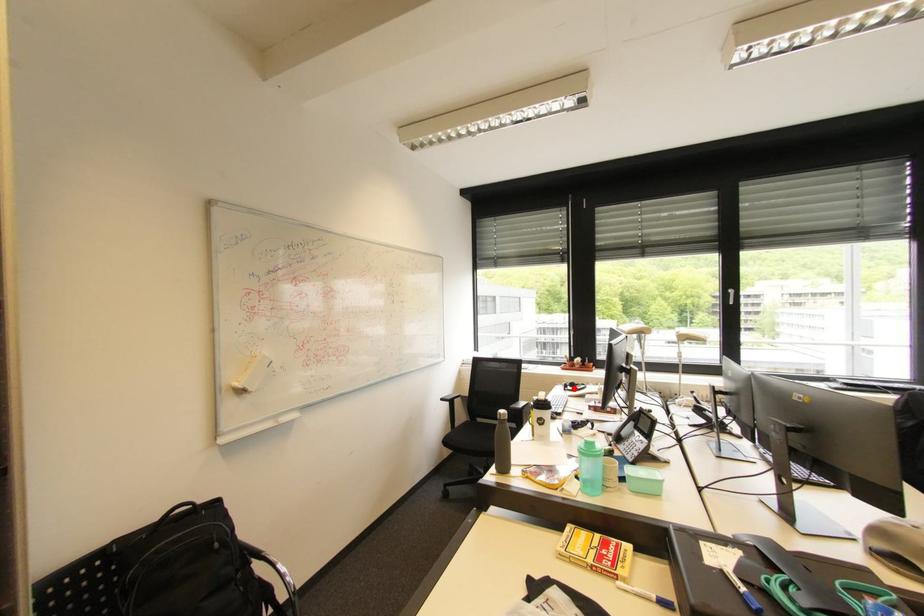
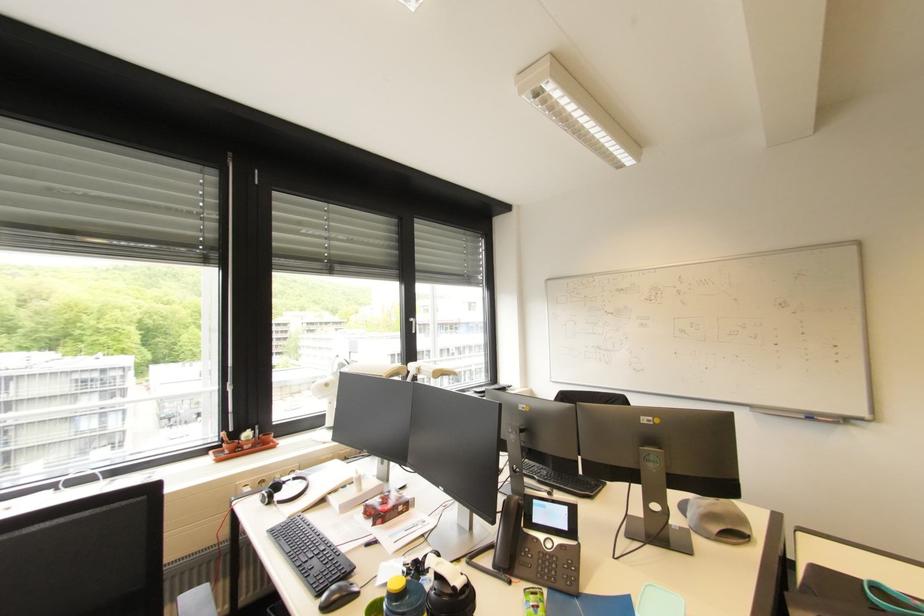
Locate, in the second image, the point that corresponds to the highlighted location in the first image.

(283, 498)